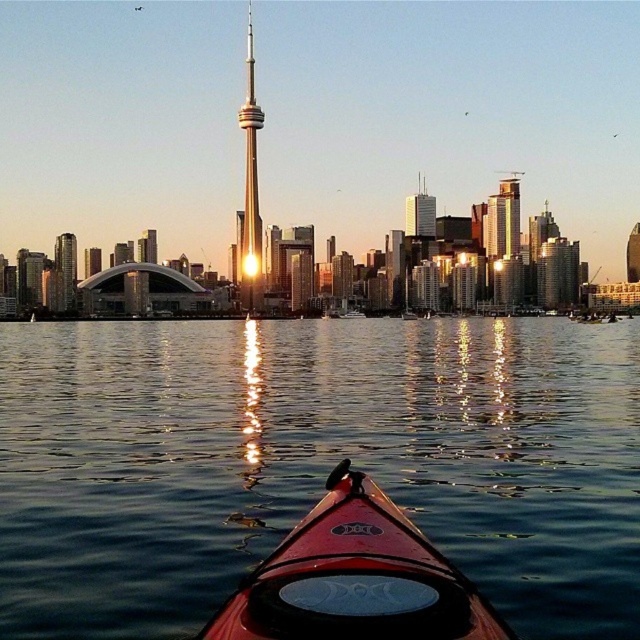
How distant is matte red canoe at center from gold reflective tower at center?

A distance of 1289.32 feet exists between matte red canoe at center and gold reflective tower at center.

Does matte red canoe at center have a lesser height compared to gold reflective tower at center?

Correct, matte red canoe at center is not as tall as gold reflective tower at center.

Which is in front, point (372, 621) or point (252, 253)?

Point (372, 621)

At what (x,y) coordinates should I click in order to perform the action: click on matte red canoe at center. Please return your answer as a coordinate pair (x, y). Image resolution: width=640 pixels, height=640 pixels. Looking at the image, I should click on (355, 579).

Can you confirm if glossy water at center is positioned to the left of matte red canoe at center?

Yes, glossy water at center is to the left of matte red canoe at center.

How much distance is there between glossy water at center and matte red canoe at center?

glossy water at center and matte red canoe at center are 322.52 feet apart.

Does point (342, 369) lie in front of point (353, 582)?

No, it is behind (353, 582).

Locate an element on the screen. This screenshot has width=640, height=640. glossy water at center is located at coordinates (314, 461).

Does glossy water at center appear under gold reflective tower at center?

Yes, glossy water at center is below gold reflective tower at center.

Is point (60, 376) closer to camera compared to point (252, 131)?

That is True.

Find the location of `glossy water at center`. glossy water at center is located at coordinates pyautogui.click(x=314, y=461).